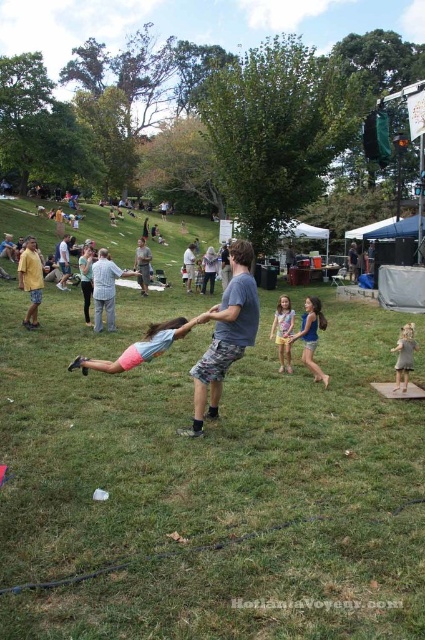
Looking at this image, which is more to the right, light gray shirt at center or multicolored fabric dress at center?

From the viewer's perspective, multicolored fabric dress at center appears more on the right side.

You are a GUI agent. You are given a task and a screenshot of the screen. Output one action in this format:
    pyautogui.click(x=<x>, y=<y>)
    Task: Click on the light gray shirt at center
    
    Given the screenshot: What is the action you would take?
    pyautogui.click(x=105, y=289)

Which is above, gray camouflage shorts at center or light blue denim jeans at center?

gray camouflage shorts at center is above.

Can you confirm if gray camouflage shorts at center is wider than light blue denim jeans at center?

Yes, gray camouflage shorts at center is wider than light blue denim jeans at center.

What are the coordinates of `gray camouflage shorts at center` in the screenshot? It's located at (142, 264).

Identify the location of gray camouflage shorts at center. The width and height of the screenshot is (425, 640). (142, 264).

Is the position of blue denim shorts at center less distant than that of multicolored fabric dress at center?

Yes, blue denim shorts at center is closer to the viewer.

Does blue denim shorts at center have a greater height compared to multicolored fabric dress at center?

Correct, blue denim shorts at center is much taller as multicolored fabric dress at center.

Identify the location of blue denim shorts at center. The width and height of the screenshot is (425, 640). (311, 337).

Locate an element on the screen. Image resolution: width=425 pixels, height=640 pixels. blue denim shorts at center is located at coordinates (311, 337).